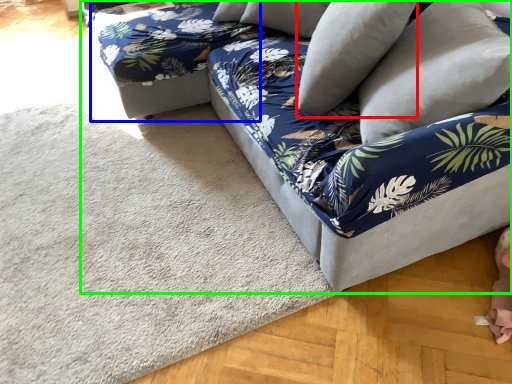
Question: Which is nearer to the pillow (highlighted by a red box)? bean bag chair (highlighted by a blue box) or studio couch (highlighted by a green box).

Choices:
 (A) bean bag chair
 (B) studio couch

Answer: (B)